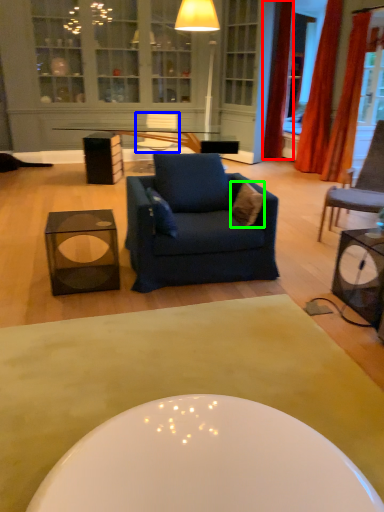
Question: Which object is the closest to the curtain (highlighted by a red box)? Choose among these: armchair (highlighted by a blue box) or pillow (highlighted by a green box).

Choices:
 (A) armchair
 (B) pillow

Answer: (A)